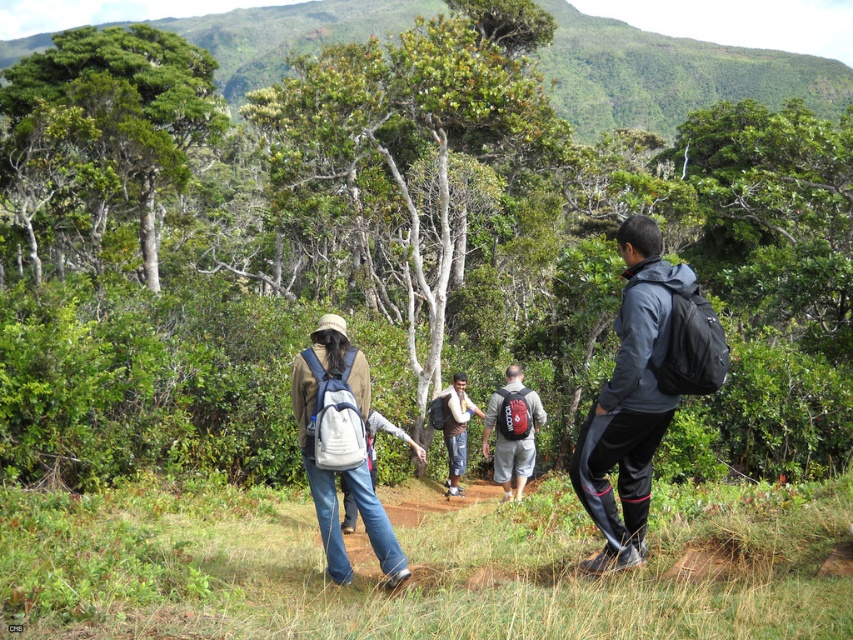
You are a drone operator trying to capture a photo of the green matte tree at upper left. The drone has a GPS coordinate system where the bottom left corner is the origin point. The tree is located at point 0.219, 0.120. If the drone is currently at point 0.150, 0.080, in which direction should you move the drone to reach the tree?

The green matte tree at upper left is located at point (x=102, y=140). The drone is at (x=67, y=96). To reach the tree, move the drone northeast because the tree is northeast of the drone.

Based on the photo, you are a hiker on the trail and want to know the relative positions of two points marked on your map. According to the image, is point (184,180) located behind or in front of point (460,410)?

Point (184,180) is behind point (460,410).